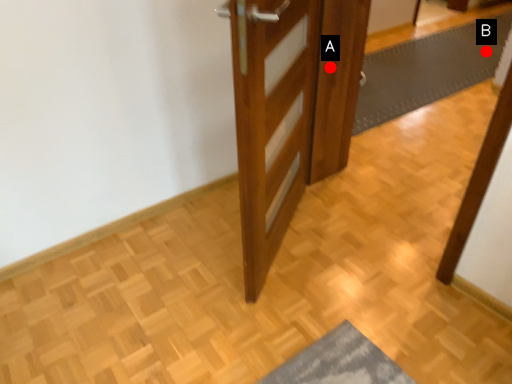
Question: Two points are circled on the image, labeled by A and B beside each circle. Which point is closer to the camera?

Choices:
 (A) A is closer
 (B) B is closer

Answer: (A)